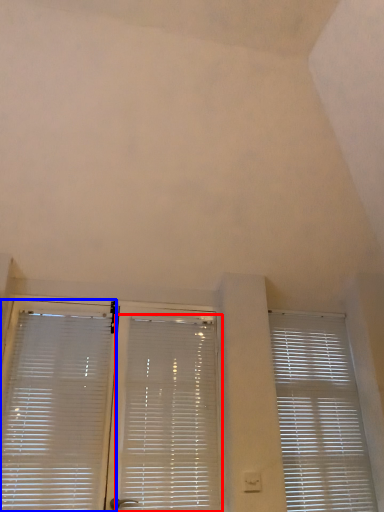
Question: Which of the following is the farthest to the observer, window blind (highlighted by a red box) or window blind (highlighted by a blue box)?

Choices:
 (A) window blind
 (B) window blind

Answer: (A)